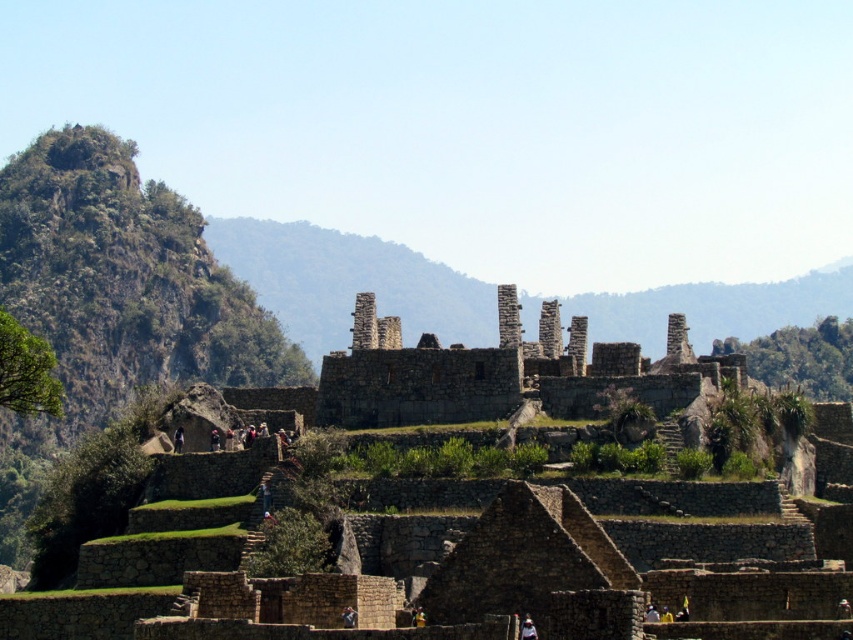
Is green rocky mountain at upper left further to the viewer compared to stone ruins at center?

Yes, it is behind stone ruins at center.

Does green rocky mountain at upper left appear on the right side of stone ruins at center?

No, green rocky mountain at upper left is not to the right of stone ruins at center.

Describe the element at coordinates (113, 301) in the screenshot. I see `green rocky mountain at upper left` at that location.

Image resolution: width=853 pixels, height=640 pixels. Identify the location of green rocky mountain at upper left. (113, 301).